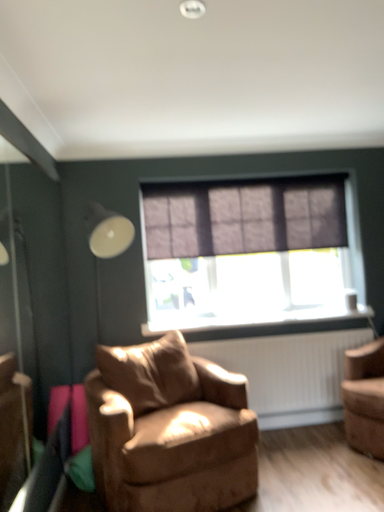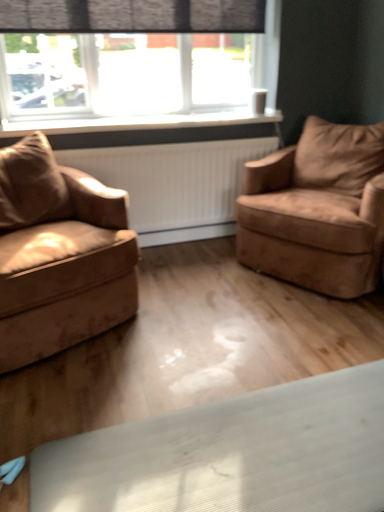
Question: Which way did the camera rotate in the video?

Choices:
 (A) rotated left
 (B) rotated right

Answer: (B)